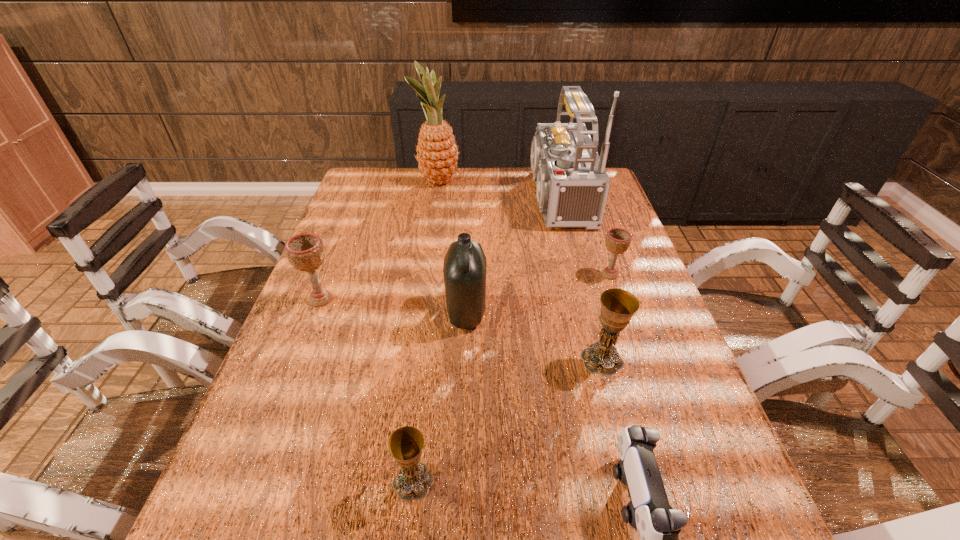
This screenshot has width=960, height=540. What are the coordinates of `pineapple` in the screenshot? It's located at click(437, 153).

The image size is (960, 540). What are the coordinates of `gray radio receiver` in the screenshot? It's located at (572, 184).

Find the location of a particular element. This screenshot has height=540, width=960. bottle is located at coordinates [464, 270].

At what (x,y) coordinates should I click in order to perform the action: click on the third chalice from left to right. Please return your answer as a coordinate pair (x, y). This screenshot has height=540, width=960. Looking at the image, I should click on (618, 306).

At what (x,y) coordinates should I click in order to perform the action: click on the bigger gold chalice. Please return your answer as a coordinate pair (x, y). Looking at the image, I should click on (618, 306).

Identify the location of the left beige chalice. The width and height of the screenshot is (960, 540). (305, 252).

The image size is (960, 540). In order to click on the leftmost chalice in this screenshot , I will do `click(305, 252)`.

I want to click on the farther beige chalice, so click(x=617, y=240).

Locate an element on the screen. Image resolution: width=960 pixels, height=540 pixels. the smaller beige chalice is located at coordinates (617, 240).

At what (x,y) coordinates should I click in order to perform the action: click on the nearer gold chalice. Please return your answer as a coordinate pair (x, y). Looking at the image, I should click on (413, 481).